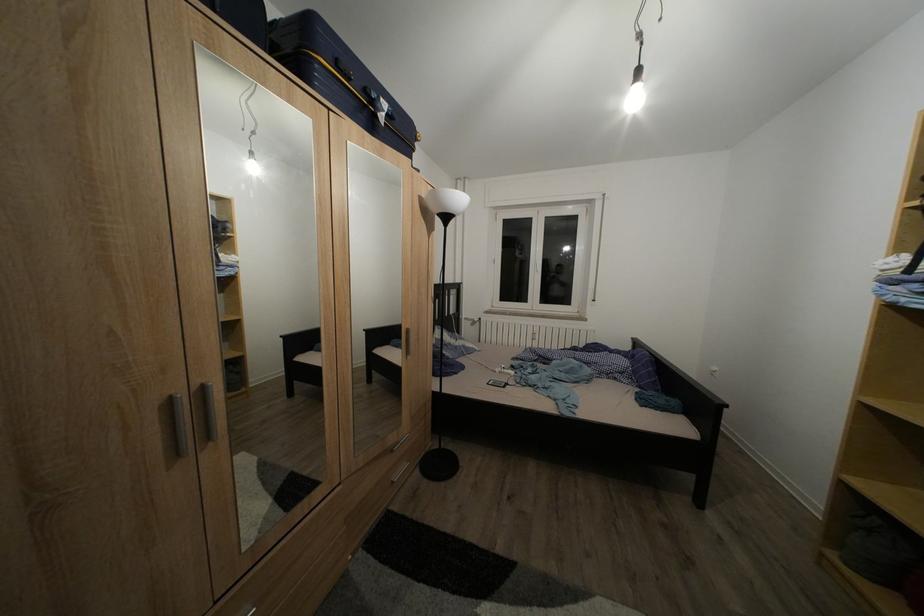
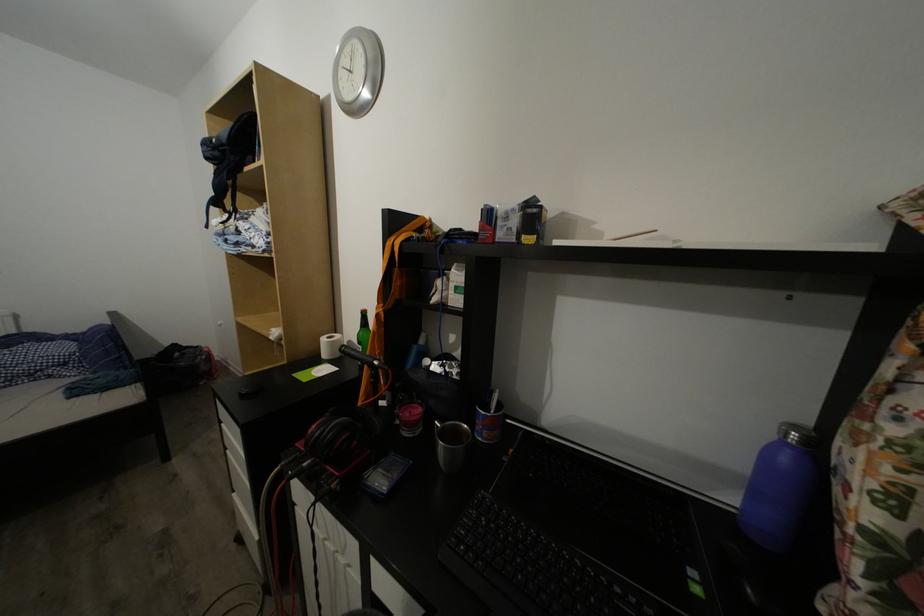
Question: The camera is either moving clockwise (left) or counter-clockwise (right) around the object. The first image is from the beginning of the video and the second image is from the end. Is the camera moving left or right when shooting the video?

Choices:
 (A) Left
 (B) Right

Answer: (A)